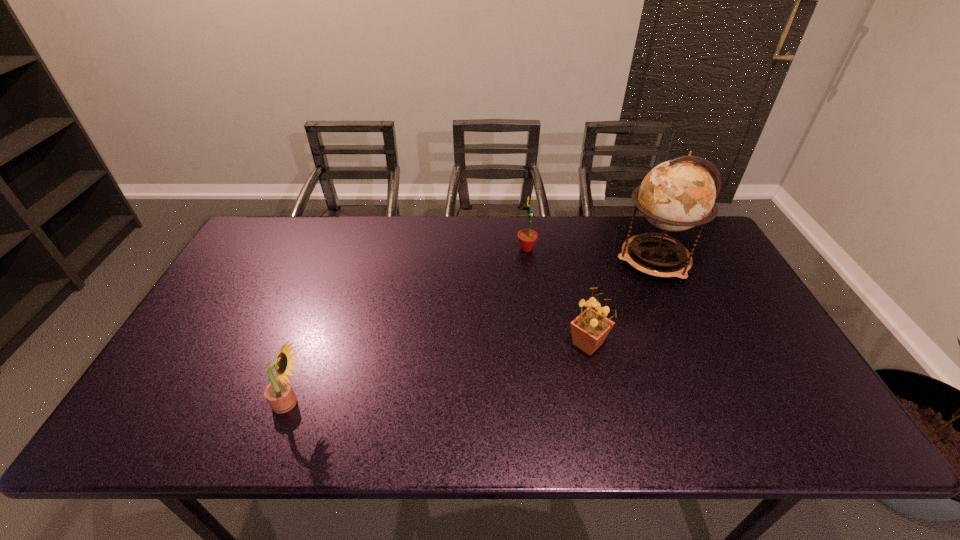
You are a GUI agent. You are given a task and a screenshot of the screen. Output one action in this format:
    pyautogui.click(x=<x>, y=<y>)
    Task: Click on the free space between the second farthest sunflower and the tallest object
    
    Given the screenshot: What is the action you would take?
    point(620,302)

Identify the location of free point between the rightmost object and the second object from left to right. (590, 254).

The width and height of the screenshot is (960, 540). I want to click on vacant area between the rightmost sunflower and the leftmost object, so click(439, 373).

Locate an element on the screen. The height and width of the screenshot is (540, 960). vacant area that lies between the second nearest sunflower and the nearest object is located at coordinates (439, 373).

This screenshot has height=540, width=960. Identify the location of blank region between the second nearest sunflower and the nearest sunflower. (439, 373).

This screenshot has height=540, width=960. Find the location of `vacant area that lies between the third farthest object and the leftmost object`. vacant area that lies between the third farthest object and the leftmost object is located at coordinates pos(439,373).

Select which object is the closest to the nearest sunflower. Please provide its 2D coordinates. Your answer should be formatted as a tuple, i.e. [(x, y)], where the tuple contains the x and y coordinates of a point satisfying the conditions above.

[(589, 330)]

Locate which object ranks second in proximity to the rightmost sunflower. Please provide its 2D coordinates. Your answer should be formatted as a tuple, i.e. [(x, y)], where the tuple contains the x and y coordinates of a point satisfying the conditions above.

[(527, 237)]

In order to click on sunflower that is the third closest to the rightmost object in this screenshot , I will do `click(279, 393)`.

Select which sunflower appears as the second closest to the third object from left to right. Please provide its 2D coordinates. Your answer should be formatted as a tuple, i.e. [(x, y)], where the tuple contains the x and y coordinates of a point satisfying the conditions above.

[(279, 393)]